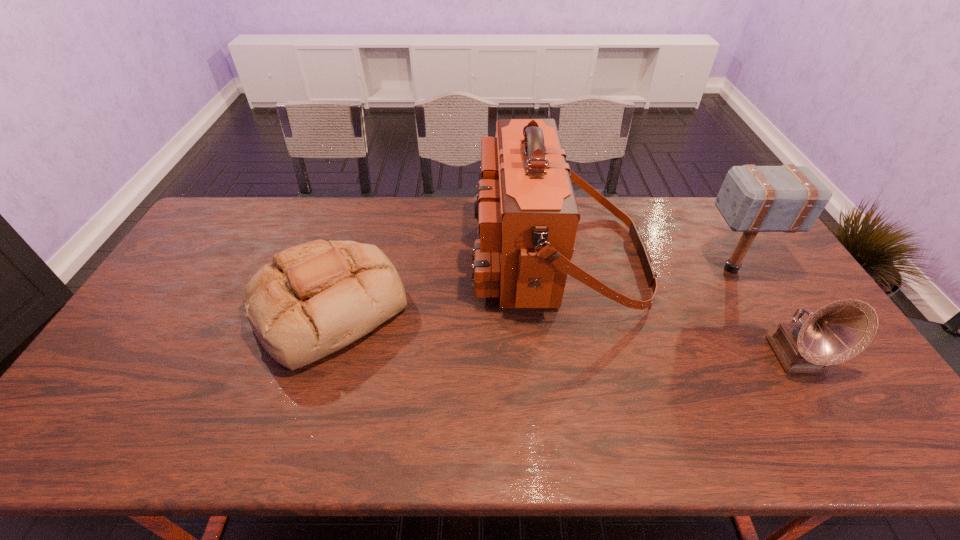
Locate an element on the screen. The width and height of the screenshot is (960, 540). object that can be found as the second closest to the third shortest object is located at coordinates (837, 332).

This screenshot has width=960, height=540. In order to click on free space that satisfies the following two spatial constraints: 1. on the striking surface of the third shortest object; 2. on the front side of the shortest object in this screenshot , I will do `click(754, 307)`.